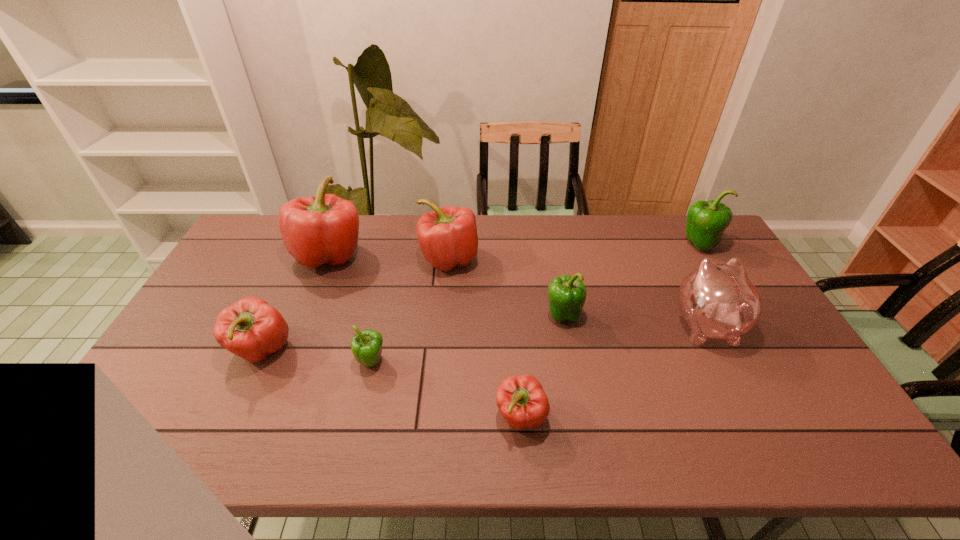
Where is `the biggest pink bell pepper`? The image size is (960, 540). the biggest pink bell pepper is located at coordinates (323, 229).

At what (x,y) coordinates should I click in order to perform the action: click on the rightmost bell pepper. Please return your answer as a coordinate pair (x, y). The width and height of the screenshot is (960, 540). Looking at the image, I should click on (706, 221).

Locate an element on the screen. The height and width of the screenshot is (540, 960). the biggest green bell pepper is located at coordinates (706, 221).

Where is `the fourth bell pepper from right to left`? the fourth bell pepper from right to left is located at coordinates (447, 237).

I want to click on the fifth object from right to left, so click(447, 237).

What are the coordinates of `piggy bank` in the screenshot? It's located at tap(718, 301).

This screenshot has height=540, width=960. In order to click on the sixth bell pepper from left to right in this screenshot , I will do `click(567, 294)`.

Identify the location of the second biggest green bell pepper. (567, 294).

The width and height of the screenshot is (960, 540). What are the coordinates of `the second smallest pink bell pepper` in the screenshot? It's located at (250, 328).

Locate an element on the screen. The height and width of the screenshot is (540, 960). the third object from left to right is located at coordinates (366, 346).